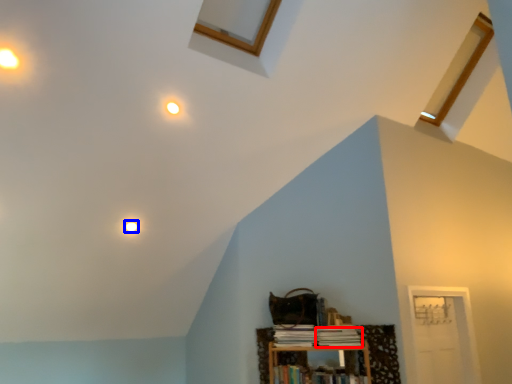
Question: Which object is closer to the camera taking this photo, book (highlighted by a red box) or light (highlighted by a blue box)?

Choices:
 (A) book
 (B) light

Answer: (A)